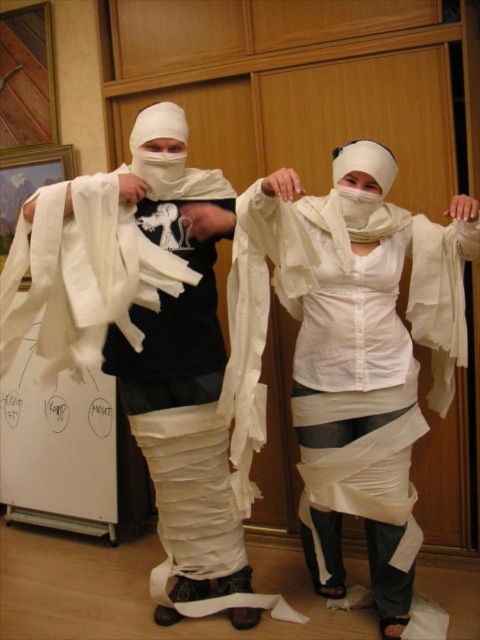
You are a photographer setting up a shot in the scene described. You need to ensure that the white matte toilet paper at center is in focus. Given that your camera can only focus on objects within a 0.1 unit radius around the point specified, will the focus point at coordinates point (350, 353) successfully capture the white matte toilet paper at center in focus?

The point (350, 353) is specified to indicate the white matte toilet paper at center. Since the focus point is exactly at this coordinate, the white matte toilet paper at center will be in focus as it is centered within the 0.1 unit radius required for sharp focus.

You are an interior designer assessing the space. You need to hang a decorative item between the white matte toilet paper at center and the white paper at center. Which object should you place closer to the wall to ensure the item fits without overlapping?

The white paper at center should be placed closer to the wall because the white matte toilet paper at center might be wider than white paper at center, so positioning the narrower one near the wall allows the decorative item to fit better without overlapping.

Based on the photo, you are a photographer in the room and want to take a photo of the two mummy figures. Since the white matte toilet paper at center and the white paper at center are both in the frame, which one should you focus on to ensure the mummy on the right is properly lit?

The white matte toilet paper at center is positioned on the right side of white paper at center. Since the mummy on the right is near the white matte toilet paper at center, focusing on it would help properly light that mummy.